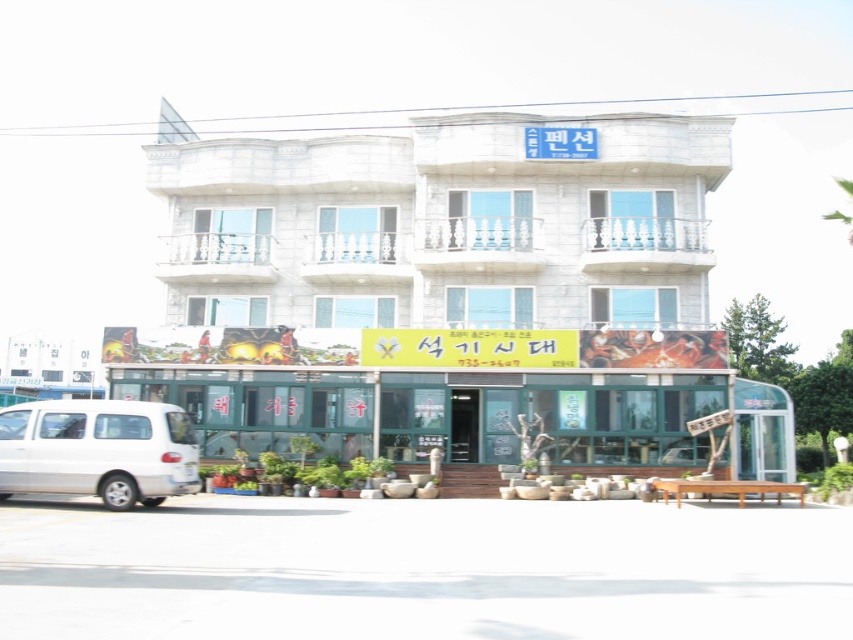
You are standing at a certain point and want to reach the entrance of the building. The entrance is located at point (155, 176). If you can walk 30 meters in 1 minute, how long will it take you to reach the entrance?

The distance between you and the entrance at point (155, 176) is 29.77 meters. Since you can walk 30 meters in 1 minute, it will take approximately 1 minute to reach the entrance.

What are the coordinates of the white stone building at center?

The white stone building at center is located at coordinates point (450, 285).

You are a delivery driver who needs to park your white matte van at lower left close to the white stone building at center. Given the width of the road, can you safely park the van next to the building without blocking the entrance?

The white stone building at center is wider than the white matte van at lower left. Since the building is wider, there should be sufficient space on the road to park the van next to it without blocking the entrance, provided the road width allows.